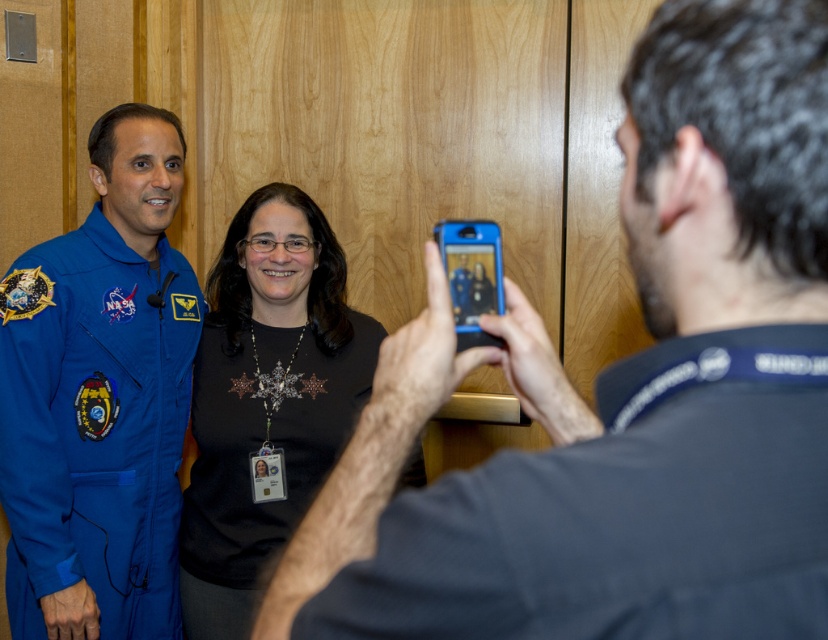
Question: Which point appears closest to the camera in this image?

Choices:
 (A) (195, 417)
 (B) (814, 188)
 (C) (123, 513)

Answer: (B)

Question: Which of these objects is positioned closest to the dark blue shirt at center?

Choices:
 (A) black matte shirt at center
 (B) blue fabric astronaut suit at left

Answer: (A)

Question: Does dark blue shirt at center lie behind blue fabric astronaut suit at left?

Choices:
 (A) yes
 (B) no

Answer: (B)

Question: Is blue fabric astronaut suit at left below black matte shirt at center?

Choices:
 (A) yes
 (B) no

Answer: (B)

Question: Is blue fabric astronaut suit at left above black matte shirt at center?

Choices:
 (A) no
 (B) yes

Answer: (B)

Question: Which object appears closest to the camera in this image?

Choices:
 (A) blue fabric astronaut suit at left
 (B) black matte shirt at center

Answer: (A)